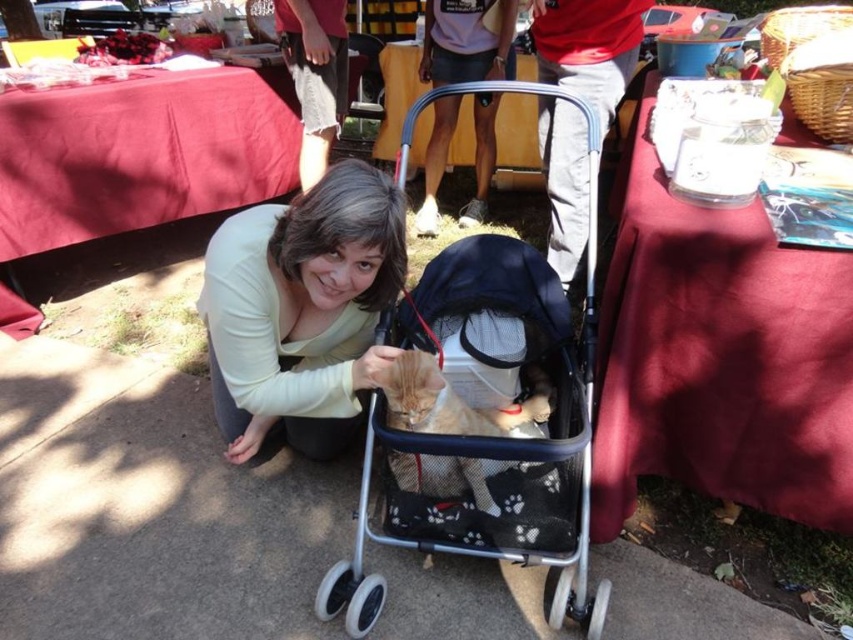
Question: Is matte yellow shirt at center wider than red cloth at upper left?

Choices:
 (A) yes
 (B) no

Answer: (B)

Question: Which point appears closest to the camera in this image?

Choices:
 (A) (405, 122)
 (B) (225, 138)
 (C) (358, 161)
 (D) (613, 316)

Answer: (C)

Question: Estimate the real-world distances between objects in this image. Which object is farther from the orange fur cat at center?

Choices:
 (A) smooth red cloth at upper right
 (B) matte yellow shirt at center
 (C) metallic silver baby carriage at center

Answer: (A)

Question: Where is matte yellow shirt at center located in relation to red cloth at upper left in the image?

Choices:
 (A) right
 (B) left

Answer: (A)

Question: Does metallic silver baby carriage at center appear over matte yellow shirt at center?

Choices:
 (A) no
 (B) yes

Answer: (A)

Question: Which point is farther to the camera?

Choices:
 (A) (x=403, y=413)
 (B) (x=776, y=312)

Answer: (A)